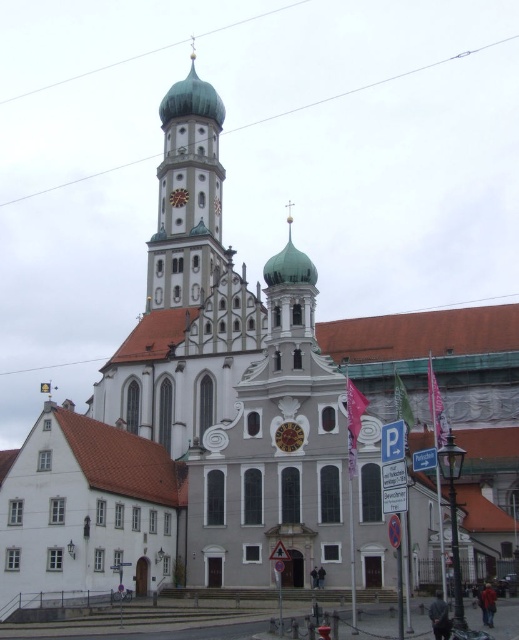
Question: Is white stone tower at center further to camera compared to gold metallic clock at center?

Choices:
 (A) no
 (B) yes

Answer: (B)

Question: Which object appears farthest from the camera in this image?

Choices:
 (A) white stone tower at center
 (B) gold metallic clock at center

Answer: (A)

Question: Which of the following is the closest to the observer?

Choices:
 (A) (185, 237)
 (B) (303, 433)

Answer: (B)

Question: Which of the following is the closest to the observer?

Choices:
 (A) white stone tower at center
 (B) gold metallic clock at center

Answer: (B)

Question: Is white stone tower at center to the right of gold metallic clock at center from the viewer's perspective?

Choices:
 (A) no
 (B) yes

Answer: (A)

Question: Is white stone tower at center to the right of gold metallic clock at center from the viewer's perspective?

Choices:
 (A) no
 (B) yes

Answer: (A)